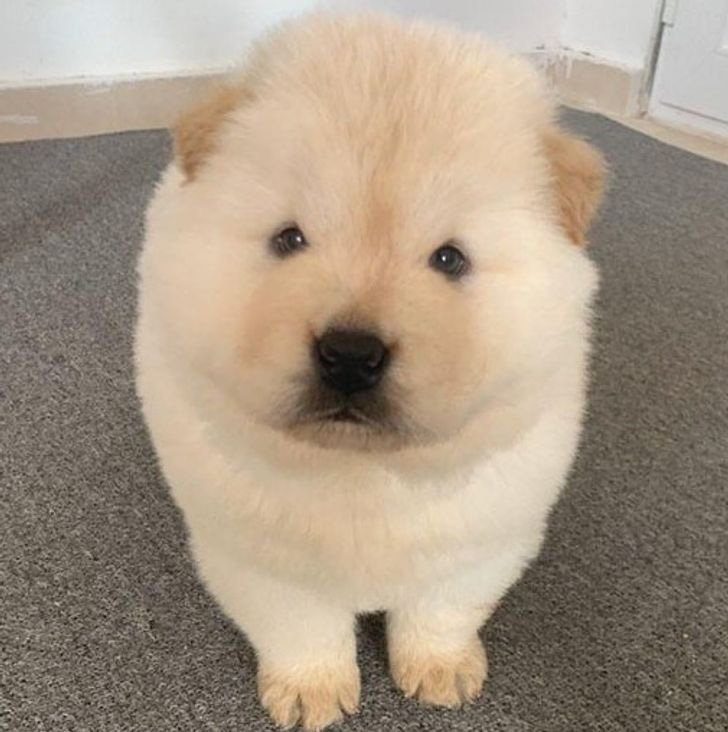
You are a GUI agent. You are given a task and a screenshot of the screen. Output one action in this format:
    pyautogui.click(x=<x>, y=<y>)
    Task: Click on the baseboard
    This screenshot has width=728, height=732.
    Given the screenshot: What is the action you would take?
    pyautogui.click(x=126, y=104)